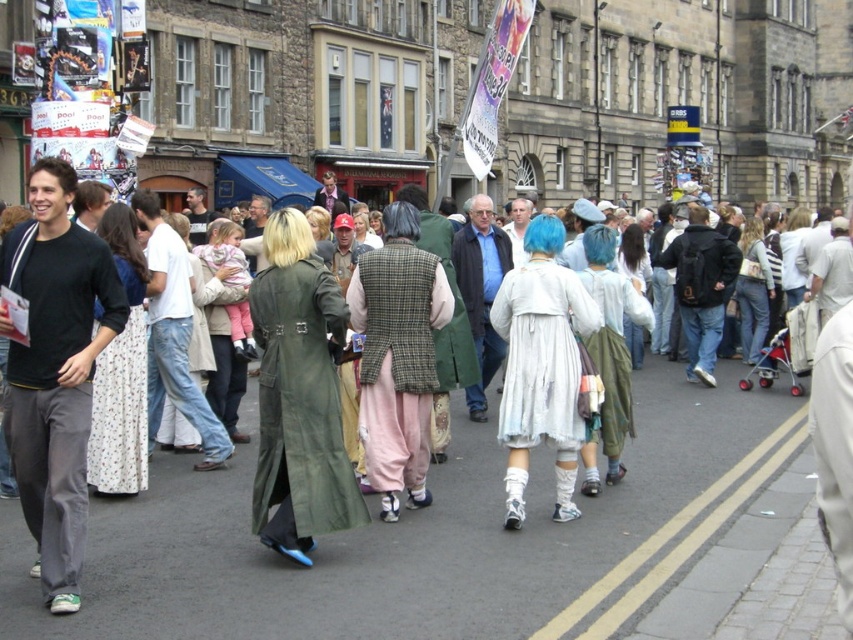
Between point (693, 216) and point (509, 230), which one is positioned in front?

Point (693, 216)

This screenshot has height=640, width=853. Describe the element at coordinates (701, 289) in the screenshot. I see `black backpack at center` at that location.

At what (x,y) coordinates should I click in order to perform the action: click on black backpack at center. Please return your answer as a coordinate pair (x, y). Image resolution: width=853 pixels, height=640 pixels. Looking at the image, I should click on (701, 289).

How distant is white textured dress at center from light blue hair at center?

A distance of 28.43 feet exists between white textured dress at center and light blue hair at center.

Where is `white textured dress at center`? Image resolution: width=853 pixels, height=640 pixels. white textured dress at center is located at coordinates (x=543, y=353).

Who is lower down, matte green coat at center or black backpack at center?

Positioned lower is black backpack at center.

Between matte green coat at center and black backpack at center, which one has more height?

matte green coat at center

Is point (347, 588) farther from viewer compared to point (691, 301)?

No, (347, 588) is in front of (691, 301).

Identify the location of matte green coat at center. The height and width of the screenshot is (640, 853). (453, 540).